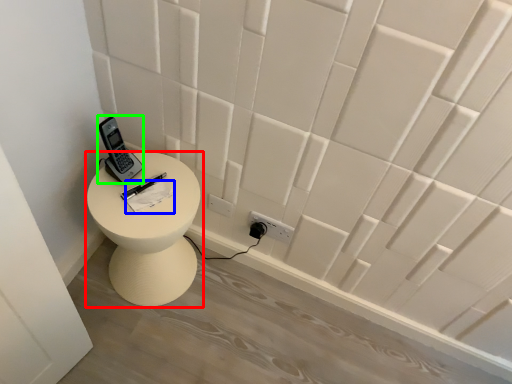
Question: Which is farther away from furniture (highlighted by a red box)? notepad (highlighted by a blue box) or control (highlighted by a green box)?

Choices:
 (A) notepad
 (B) control

Answer: (B)